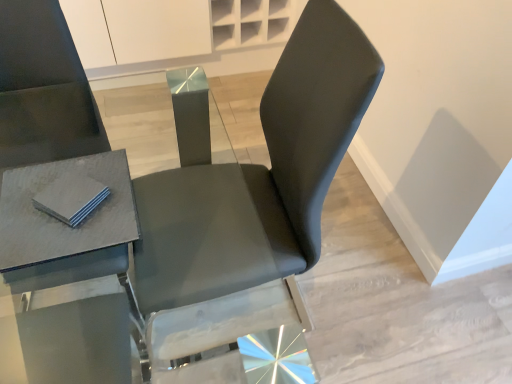
This screenshot has height=384, width=512. What do you see at coordinates (258, 176) in the screenshot?
I see `matte black chair at center` at bounding box center [258, 176].

Find the location of a particular element. Image resolution: width=512 pixels, height=384 pixels. matte black chair at center is located at coordinates (258, 176).

Looking at their sizes, would you say matte black chair at center is wider or thinner than matte gray table at left?

Considering their sizes, matte black chair at center looks broader than matte gray table at left.

The width and height of the screenshot is (512, 384). I want to click on chair behind the matte gray table at left, so click(258, 176).

Who is bigger, matte black chair at center or matte gray table at left?

matte black chair at center.

From a real-world perspective, is matte black chair at center on matte gray table at left?

Incorrect, from a real-world perspective, matte black chair at center is lower than matte gray table at left.

From a real-world perspective, between matte gray table at left and matte black chair at center, who is vertically lower?

From a 3D spatial view, matte black chair at center is below.

In the image, there is a matte gray table at left. Identify the location of chair below it (from a real-world perspective). The image size is (512, 384). (258, 176).

Is point (19, 223) closer or farther from the camera than point (263, 108)?

Point (19, 223) appears to be closer to the viewer than point (263, 108).

How different are the orientations of matte gray table at left and matte black chair at center in degrees?

The facing directions of matte gray table at left and matte black chair at center are 92.7 degrees apart.

Between point (102, 197) and point (320, 183), which one is positioned in front?

Positioned in front is point (102, 197).

From the image's perspective, relative to matte black chair at center, is gray matte pad at upper left above or below?

gray matte pad at upper left is situated higher than matte black chair at center in the image.

From a real-world perspective, which object rests below the other?

matte black chair at center, from a real-world perspective.

Is matte gray table at left beside gray matte pad at upper left?

No, matte gray table at left is not in contact with gray matte pad at upper left.

From the picture: Considering the sizes of objects matte gray table at left and gray matte pad at upper left in the image provided, who is wider, matte gray table at left or gray matte pad at upper left?

matte gray table at left is wider.

Is matte gray table at left looking in the opposite direction of gray matte pad at upper left?

matte gray table at left does not have its back to gray matte pad at upper left.

From a real-world perspective, between matte gray table at left and gray matte pad at upper left, who is vertically higher?

From a 3D spatial view, gray matte pad at upper left is above.

From the image's perspective, which is below, matte black chair at center or gray matte pad at upper left?

From the image's view, matte black chair at center is below.

Is matte black chair at center oriented away from gray matte pad at upper left?

No, matte black chair at center is not facing away from gray matte pad at upper left.

Choose the correct answer: Is matte black chair at center inside gray matte pad at upper left or outside it?

matte black chair at center lies outside gray matte pad at upper left.

Is matte black chair at center next to gray matte pad at upper left?

No, matte black chair at center is not next to gray matte pad at upper left.

Is gray matte pad at upper left wider than matte gray table at left?

In fact, gray matte pad at upper left might be narrower than matte gray table at left.

Is gray matte pad at upper left not inside matte gray table at left?

No, gray matte pad at upper left is not outside of matte gray table at left.

Is gray matte pad at upper left oriented away from matte gray table at left?

No, gray matte pad at upper left's orientation is not away from matte gray table at left.

In order to click on chair lying above the matte gray table at left (from the image's perspective) in this screenshot , I will do `click(258, 176)`.

Where is `chair behind the matte gray table at left`? chair behind the matte gray table at left is located at coordinates (258, 176).

Which object lies further to the anchor point matte gray table at left, gray matte pad at upper left or matte black chair at center?

matte black chair at center is further to matte gray table at left.

From the image, which object appears to be farther from gray matte pad at upper left, matte black chair at center or matte gray table at left?

matte black chair at center.

Which object lies further to the anchor point gray matte pad at upper left, matte gray table at left or matte black chair at center?

Among the two, matte black chair at center is located further to gray matte pad at upper left.

Which object lies further to the anchor point matte black chair at center, gray matte pad at upper left or matte gray table at left?

gray matte pad at upper left.

Considering their positions, is matte black chair at center positioned closer to matte gray table at left than gray matte pad at upper left?

Based on the image, gray matte pad at upper left appears to be nearer to matte gray table at left.

Looking at the image, which one is located closer to matte black chair at center, matte gray table at left or gray matte pad at upper left?

matte gray table at left is closer to matte black chair at center.

The image size is (512, 384). Find the location of `chair between matte gray table at left and gray matte pad at upper left from front to back`. chair between matte gray table at left and gray matte pad at upper left from front to back is located at coordinates (258, 176).